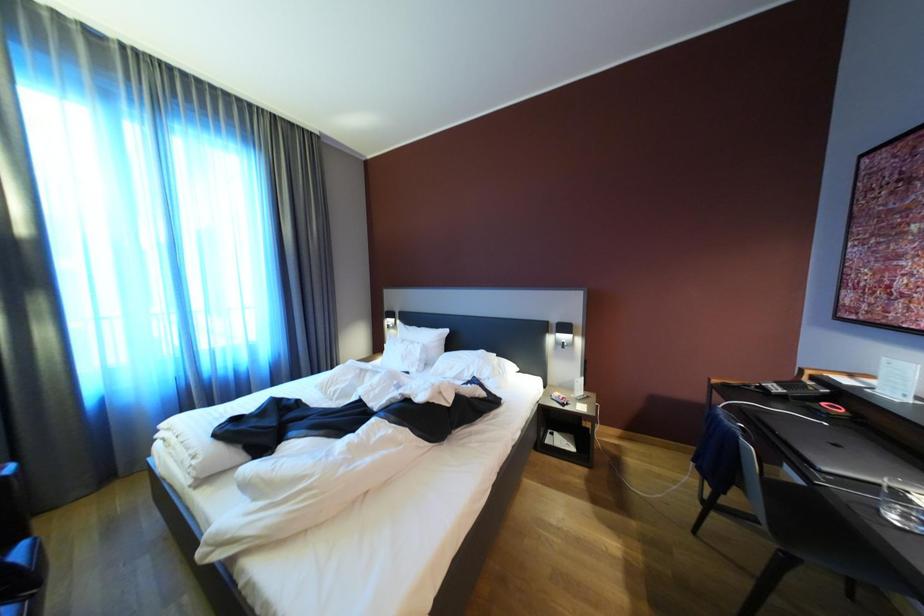
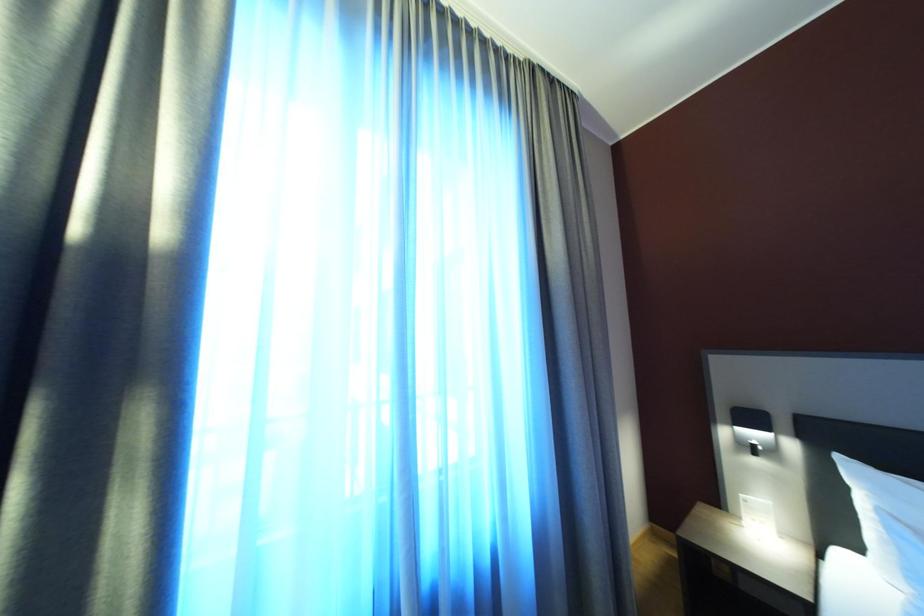
What movement of the cameraman would produce the second image?

The movement direction of the cameraman is left, forward.